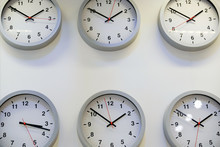
Identify the location of clock. (33, 31), (111, 137), (183, 132), (37, 125), (109, 30), (179, 28).